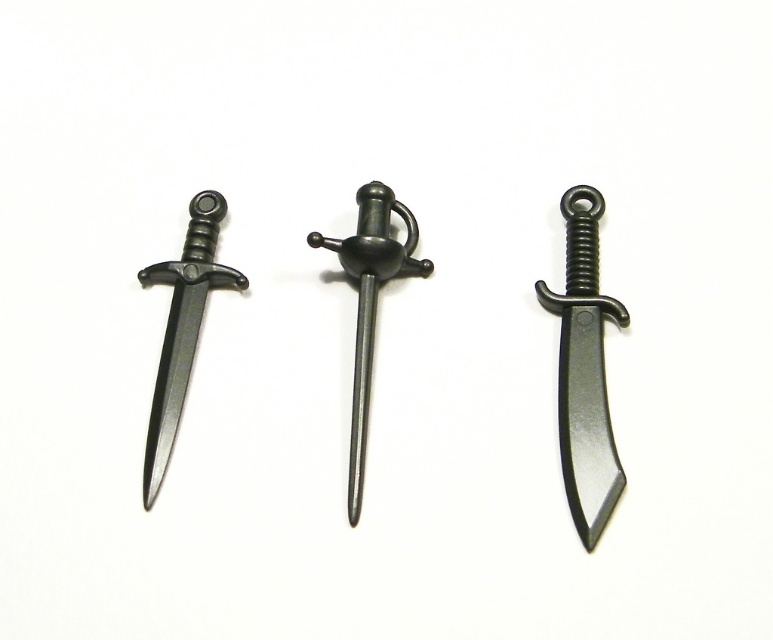
Question: Which of the following is the closest to the observer?

Choices:
 (A) (226, 275)
 (B) (583, 490)
 (C) (342, 259)

Answer: (B)

Question: Is matte black sword at center above matte black blade at center?

Choices:
 (A) no
 (B) yes

Answer: (B)

Question: Does black matte dagger at center have a larger size compared to matte black sword at center?

Choices:
 (A) yes
 (B) no

Answer: (B)

Question: Which object is positioned closest to the matte black sword at center?

Choices:
 (A) black matte dagger at center
 (B) matte black dagger at left

Answer: (B)

Question: Is black matte dagger at center bigger than matte black blade at center?

Choices:
 (A) yes
 (B) no

Answer: (A)

Question: Among these objects, which one is nearest to the camera?

Choices:
 (A) matte black sword at center
 (B) matte black blade at center

Answer: (A)